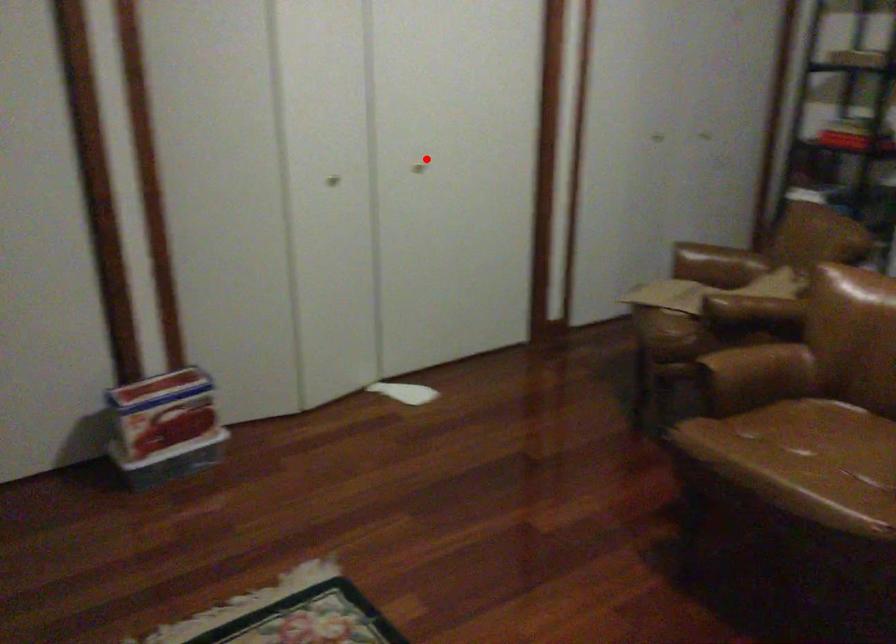
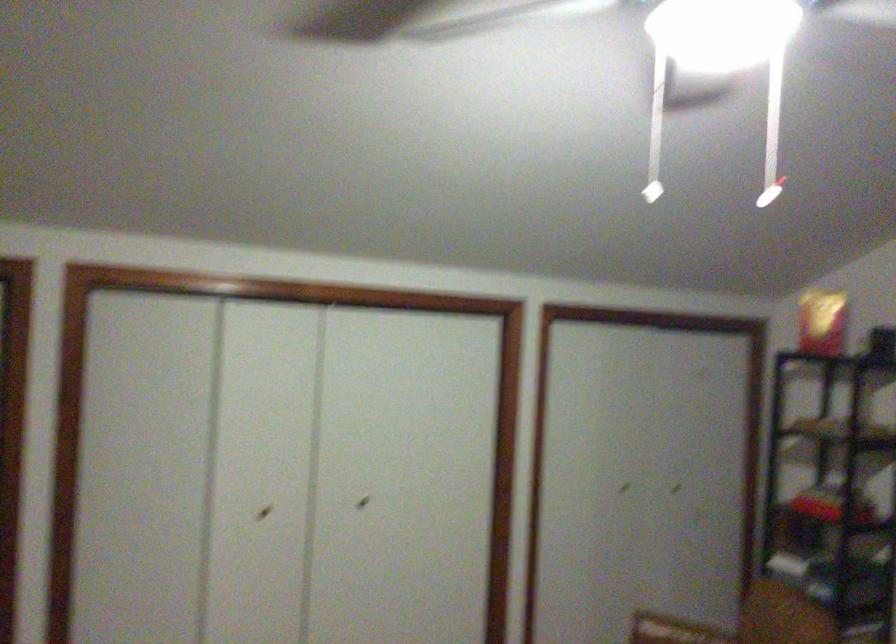
Find the pixel in the second image that matches the highlighted location in the first image.

(363, 502)